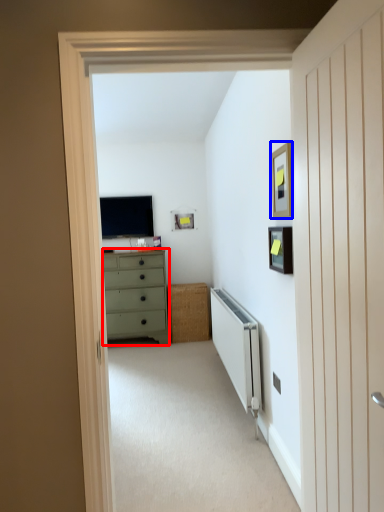
Question: Which object is further to the camera taking this photo, chest of drawers (highlighted by a red box) or picture frame (highlighted by a blue box)?

Choices:
 (A) chest of drawers
 (B) picture frame

Answer: (A)